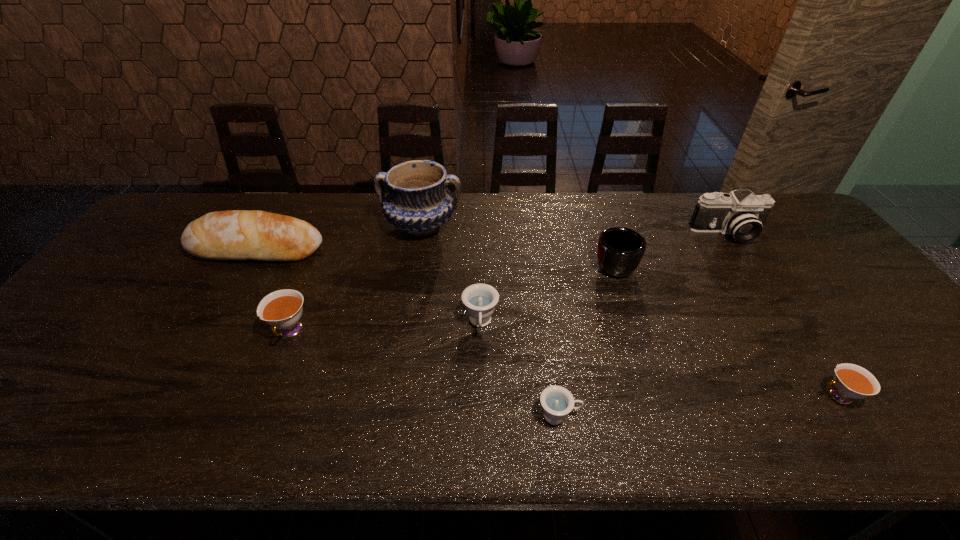
Where is `pottery`? Image resolution: width=960 pixels, height=540 pixels. pottery is located at coordinates (418, 202).

Find the location of a particular element. This screenshot has width=960, height=540. the sixth object from right to left is located at coordinates (418, 202).

This screenshot has height=540, width=960. In order to click on camera in this screenshot , I will do `click(741, 213)`.

At what (x,y) coordinates should I click in order to perform the action: click on beige bread. Please return your answer as a coordinate pair (x, y). The image size is (960, 540). Looking at the image, I should click on (235, 234).

I want to click on the third tallest object, so click(235, 234).

This screenshot has width=960, height=540. What are the coordinates of `red mug` in the screenshot? It's located at (620, 250).

Identify the location of mug. (x=620, y=250).

This screenshot has width=960, height=540. Identify the location of the left white teacup. (282, 309).

This screenshot has width=960, height=540. Find the location of `the leftmost teacup`. the leftmost teacup is located at coordinates (282, 309).

Locate an element on the screen. the farther blue teacup is located at coordinates (480, 300).